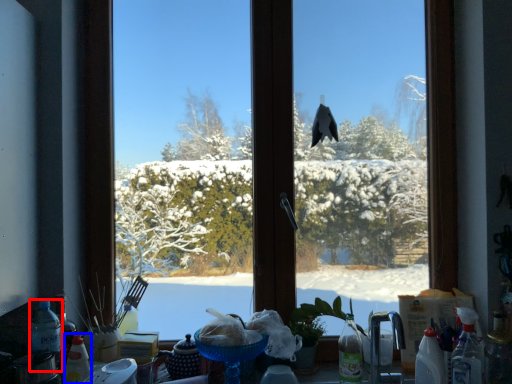
Question: Which point is further to the camera, bottle (highlighted by a red box) or bottle (highlighted by a blue box)?

Choices:
 (A) bottle
 (B) bottle

Answer: (A)